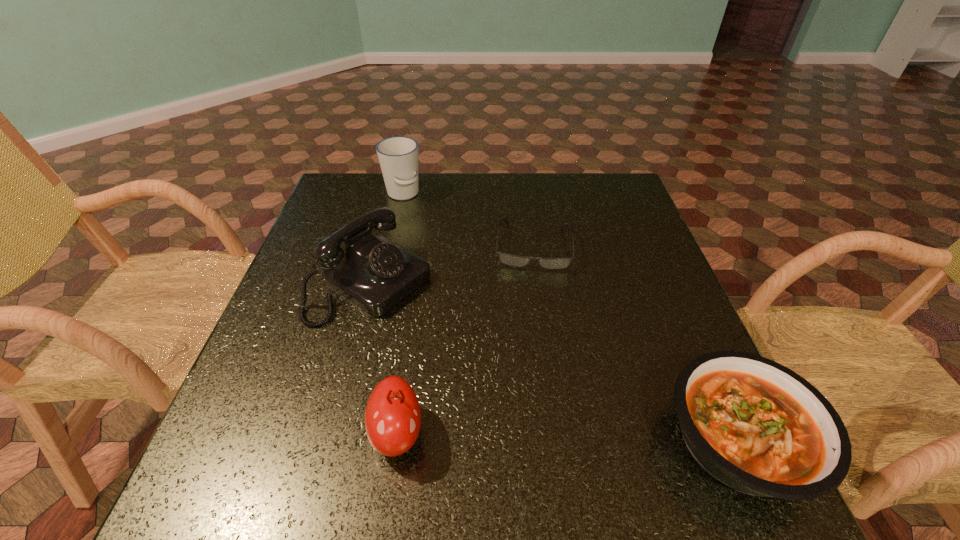
Locate an element on the screen. The image size is (960, 540). stew positioned at the near edge is located at coordinates (756, 426).

At what (x,y) coordinates should I click in order to perform the action: click on cup that is at the left edge. Please return your answer as a coordinate pair (x, y). This screenshot has width=960, height=540. Looking at the image, I should click on (398, 156).

Identify the location of telephone positioned at the left edge. (x=373, y=273).

Locate an element on the screen. The height and width of the screenshot is (540, 960). object that is at the right edge is located at coordinates (756, 426).

What are the coordinates of `object located at the far left corner` in the screenshot? It's located at (398, 156).

At what (x,y) coordinates should I click in order to perform the action: click on object present at the near right corner. Please return your answer as a coordinate pair (x, y). Looking at the image, I should click on (756, 426).

Image resolution: width=960 pixels, height=540 pixels. In order to click on free space at the far edge of the desktop in this screenshot , I will do `click(508, 193)`.

In the image, there is a desktop. In order to click on blank space at the near edge in this screenshot , I will do `click(540, 402)`.

Locate an element on the screen. vacant space at the right edge of the desktop is located at coordinates (622, 218).

Identify the location of blank space at the far left corner of the desktop. The width and height of the screenshot is (960, 540). (359, 215).